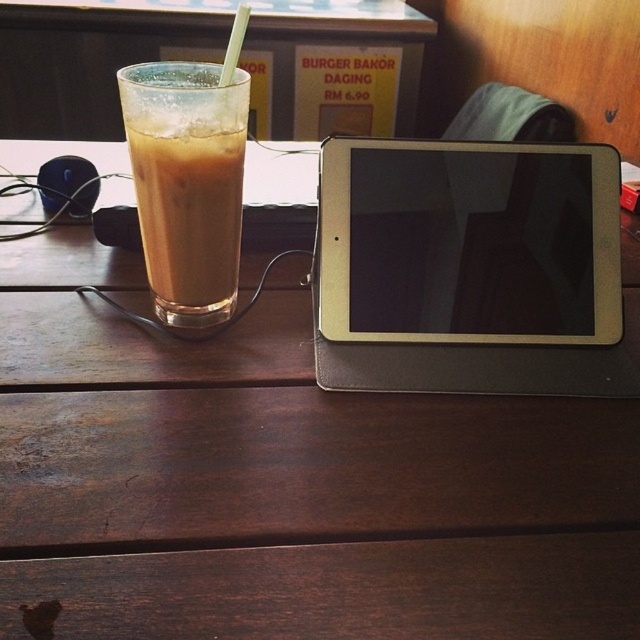
Question: Is silver metallic tablet at center wider than translucent glass cup at left?

Choices:
 (A) yes
 (B) no

Answer: (A)

Question: Can you confirm if silver metallic tablet at center is thinner than translucent glass cup at left?

Choices:
 (A) yes
 (B) no

Answer: (B)

Question: Among these points, which one is nearest to the camera?

Choices:
 (A) (573, 253)
 (B) (141, 118)

Answer: (B)

Question: Which object is closer to the camera taking this photo?

Choices:
 (A) silver metallic tablet at center
 (B) translucent glass cup at left

Answer: (B)

Question: Among these points, which one is nearest to the camera?

Choices:
 (A) (483, 337)
 (B) (154, 152)

Answer: (B)

Question: Does silver metallic tablet at center have a larger size compared to translucent glass cup at left?

Choices:
 (A) no
 (B) yes

Answer: (A)